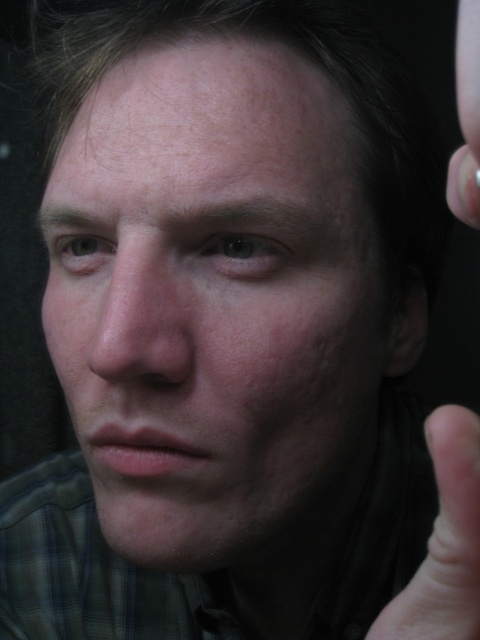
Question: Is smooth skin face at center further to camera compared to smooth skin thumb at lower right?

Choices:
 (A) no
 (B) yes

Answer: (B)

Question: Which object appears closest to the camera in this image?

Choices:
 (A) smooth skin thumb at lower right
 (B) smooth skin face at center

Answer: (A)

Question: Can you confirm if smooth skin face at center is bigger than smooth skin thumb at lower right?

Choices:
 (A) no
 (B) yes

Answer: (B)

Question: Which object is farther from the camera taking this photo?

Choices:
 (A) smooth skin face at center
 (B) smooth skin thumb at lower right

Answer: (A)

Question: Which object appears farthest from the camera in this image?

Choices:
 (A) smooth skin face at center
 (B) smooth skin thumb at lower right

Answer: (A)

Question: Considering the relative positions of smooth skin face at center and smooth skin thumb at lower right in the image provided, where is smooth skin face at center located with respect to smooth skin thumb at lower right?

Choices:
 (A) below
 (B) above

Answer: (B)